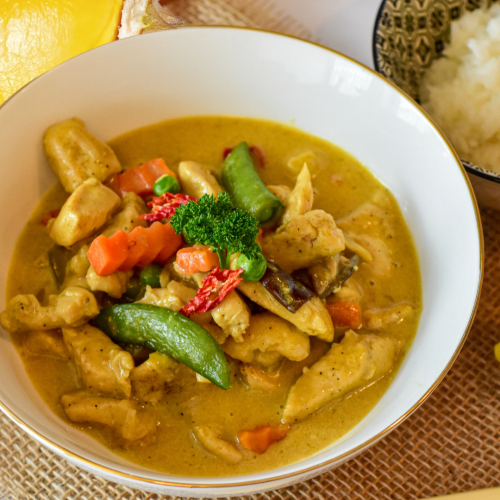
Find the location of a particular element. tablecloth is located at coordinates (456, 454).